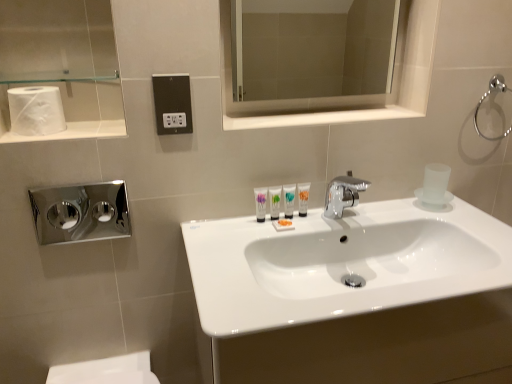
In order to click on free area in between white glossy tube at center, which is the 2th toiletry from left to right, and polished chrome faucet at center in this screenshot , I will do `click(307, 221)`.